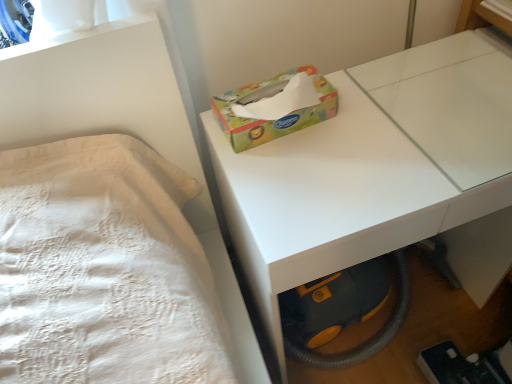
Question: Is white glossy table at center wider or thinner than multicolored cardboard tissue box at center?

Choices:
 (A) thin
 (B) wide

Answer: (B)

Question: From the image's perspective, relative to multicolored cardboard tissue box at center, is white glossy table at center above or below?

Choices:
 (A) below
 (B) above

Answer: (A)

Question: Considering the positions of white glossy table at center and multicolored cardboard tissue box at center in the image, is white glossy table at center taller or shorter than multicolored cardboard tissue box at center?

Choices:
 (A) tall
 (B) short

Answer: (A)

Question: Considering the positions of point (331, 86) and point (377, 160), is point (331, 86) closer or farther from the camera than point (377, 160)?

Choices:
 (A) closer
 (B) farther

Answer: (B)

Question: Is multicolored cardboard tissue box at center to the left or to the right of white glossy table at center in the image?

Choices:
 (A) right
 (B) left

Answer: (B)

Question: In terms of height, does multicolored cardboard tissue box at center look taller or shorter compared to white glossy table at center?

Choices:
 (A) tall
 (B) short

Answer: (B)

Question: Looking at their shapes, would you say multicolored cardboard tissue box at center is wider or thinner than white glossy table at center?

Choices:
 (A) thin
 (B) wide

Answer: (A)